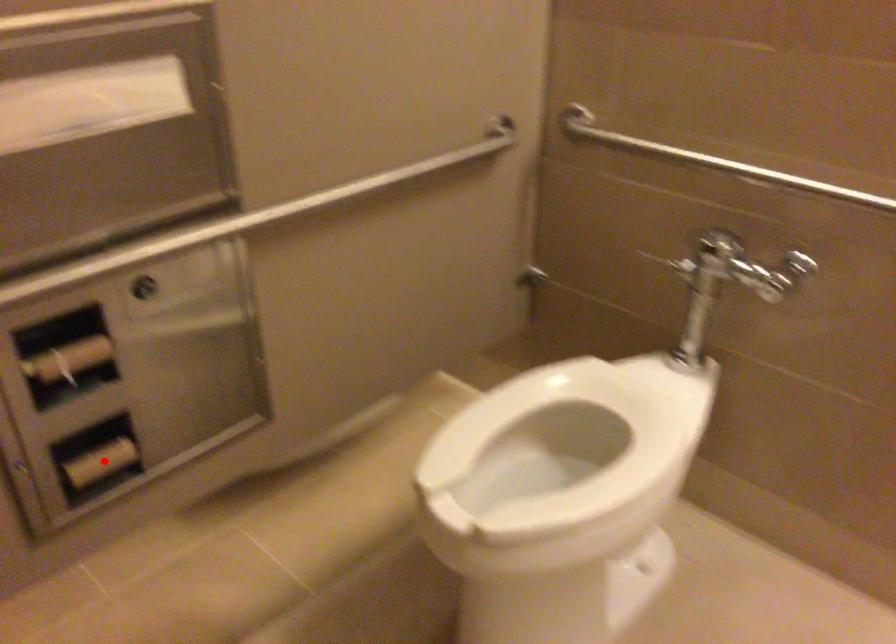
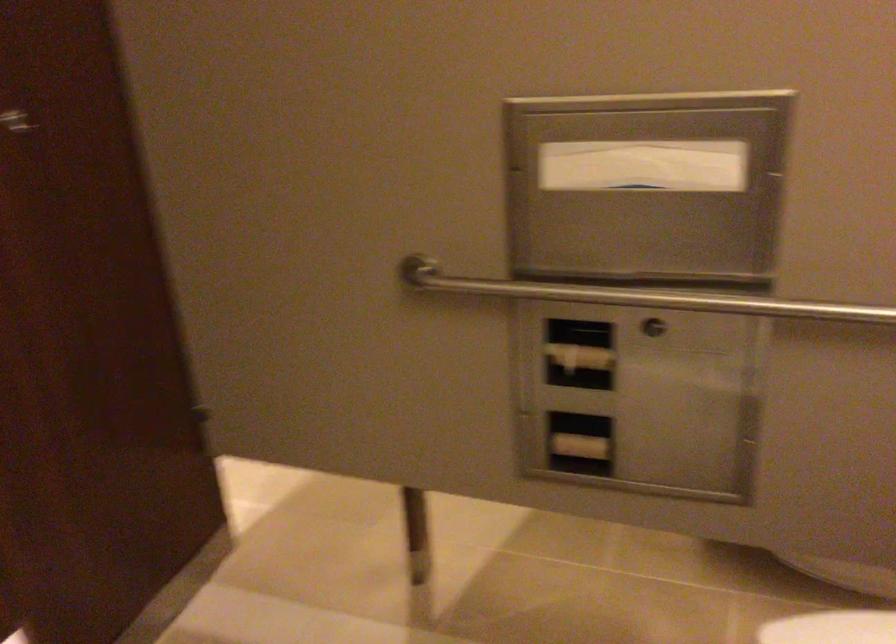
Where in the second image is the point corresponding to the highlighted location from the first image?

(580, 446)